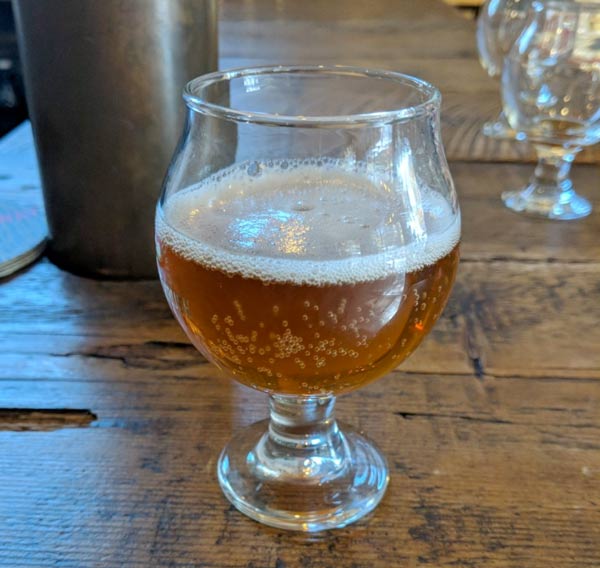
You are a GUI agent. You are given a task and a screenshot of the screen. Output one action in this format:
    pyautogui.click(x=<x>, y=<y>)
    Task: Click on the foam
    
    Given the screenshot: What is the action you would take?
    pyautogui.click(x=331, y=200)